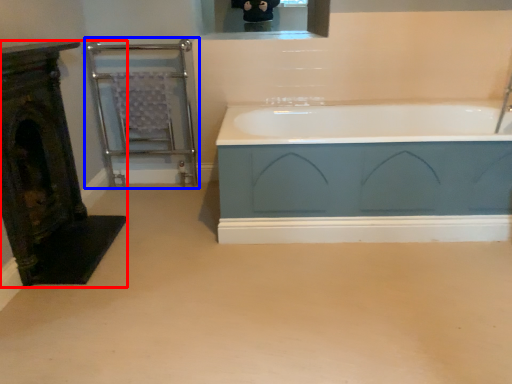
Question: Which object appears farthest to the camera in this image, fireplace (highlighted by a red box) or balustrade (highlighted by a blue box)?

Choices:
 (A) fireplace
 (B) balustrade

Answer: (B)